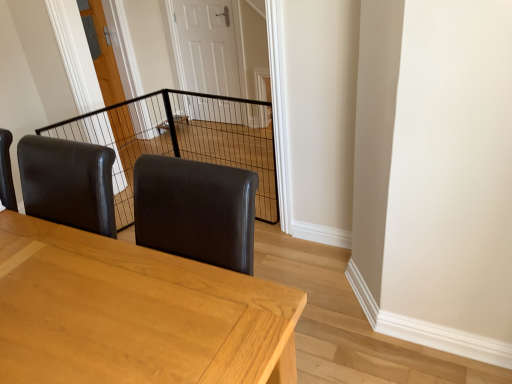
You are a GUI agent. You are given a task and a screenshot of the screen. Output one action in this format:
    pyautogui.click(x=<x>, y=<y>)
    Task: Click on the free space above light brown wooden table at center (from a real-world perspective)
    This screenshot has height=384, width=512.
    Given the screenshot: What is the action you would take?
    pyautogui.click(x=83, y=294)